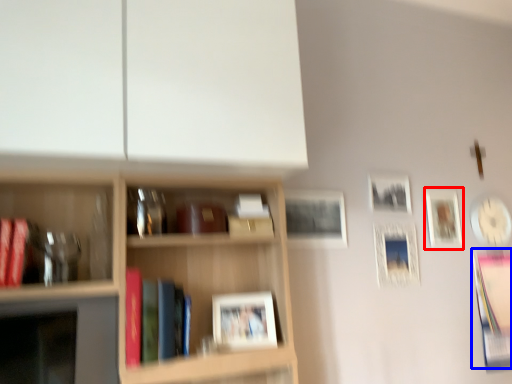
Question: Which of the following is the farthest to the observer, picture frame (highlighted by a red box) or book (highlighted by a blue box)?

Choices:
 (A) picture frame
 (B) book

Answer: (A)